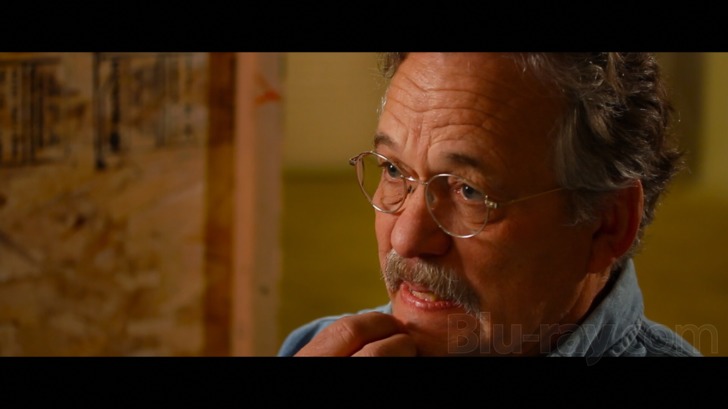
This screenshot has height=409, width=728. Identify the location of wall. (223, 190).